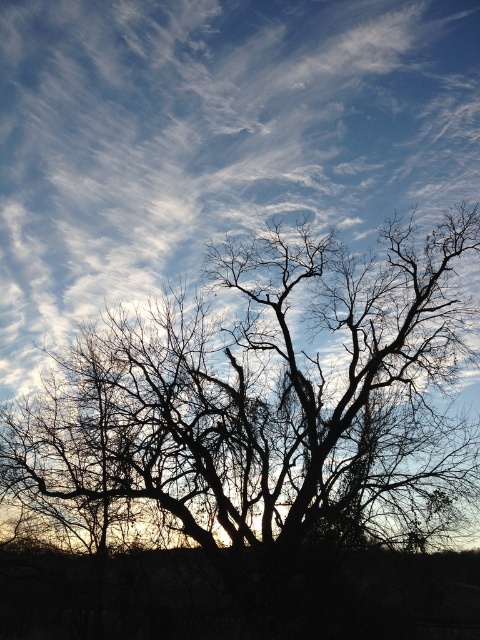
Looking at the scene with the white cotton cloud at upper center and the silhouette bark tree at center, which object has a greater width?

The white cotton cloud at upper center has a greater width than the silhouette bark tree at center.

You are an astronomer analyzing the image of the sky. You need to identify the position of the white cotton cloud at upper center. What are its coordinates?

The white cotton cloud at upper center is located at point (213, 138).